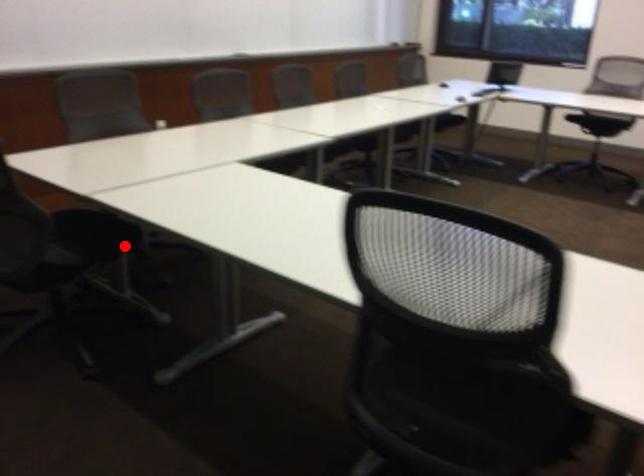
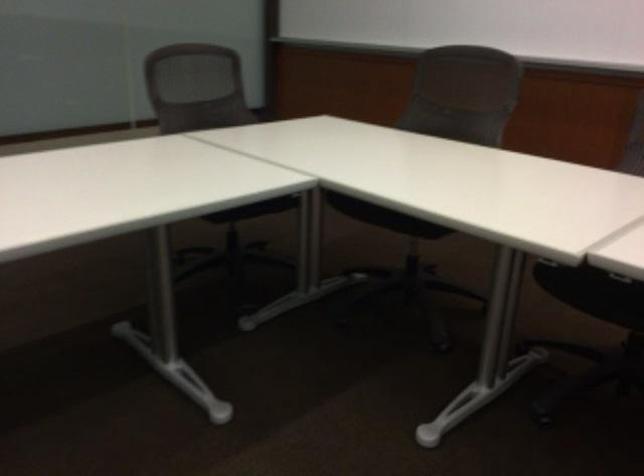
Locate, in the second image, the point that corresponds to the highlighted location in the first image.

(254, 209)